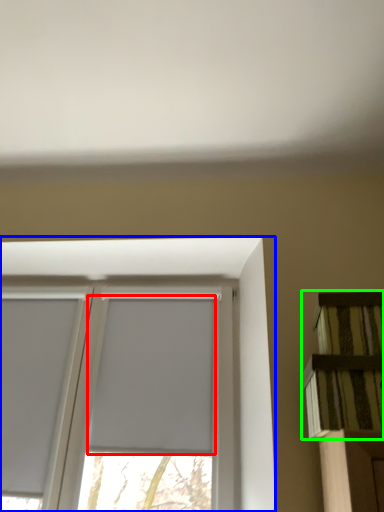
Question: Estimate the real-world distances between objects in this image. Which object is closer to window screen (highlighted by a red box), window (highlighted by a blue box) or shelf (highlighted by a green box)?

Choices:
 (A) window
 (B) shelf

Answer: (A)